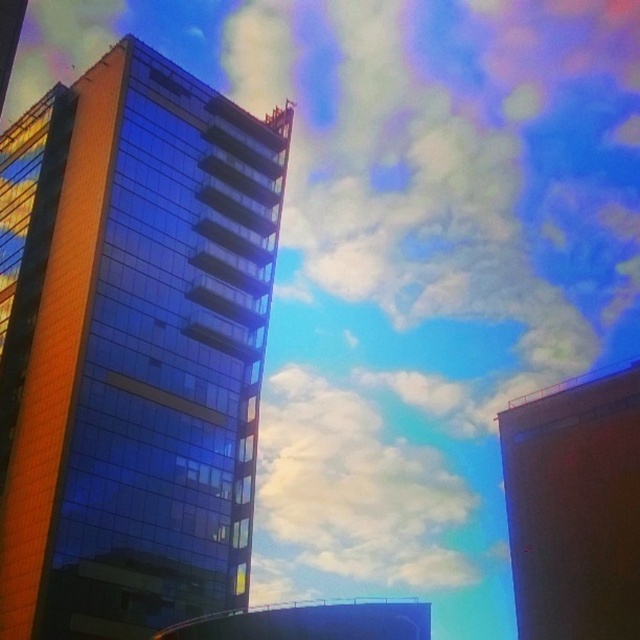
Question: Is shiny glass building at left wider than white fluffy cloud at upper center?

Choices:
 (A) yes
 (B) no

Answer: (B)

Question: Does shiny glass building at left have a greater width compared to white fluffy cloud at upper center?

Choices:
 (A) no
 (B) yes

Answer: (A)

Question: Which of the following is the farthest from the observer?

Choices:
 (A) (344, 449)
 (B) (164, 252)

Answer: (A)

Question: Is shiny glass building at left below white fluffy cloud at upper center?

Choices:
 (A) no
 (B) yes

Answer: (A)

Question: Which object appears closest to the camera in this image?

Choices:
 (A) shiny glass building at left
 (B) white fluffy cloud at upper center

Answer: (A)

Question: Among these points, which one is farthest from the camera?

Choices:
 (A) (348, 548)
 (B) (45, 563)

Answer: (A)